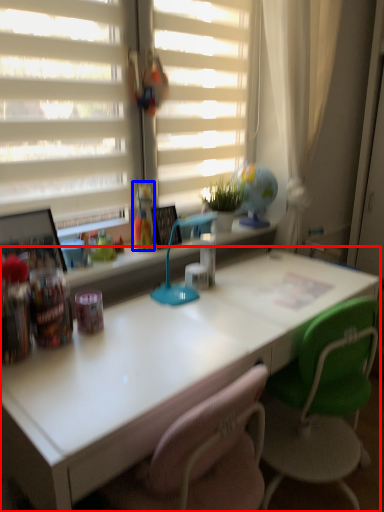
Question: Which object appears closest to the camera in this image, desk (highlighted by a red box) or toy (highlighted by a blue box)?

Choices:
 (A) desk
 (B) toy

Answer: (A)